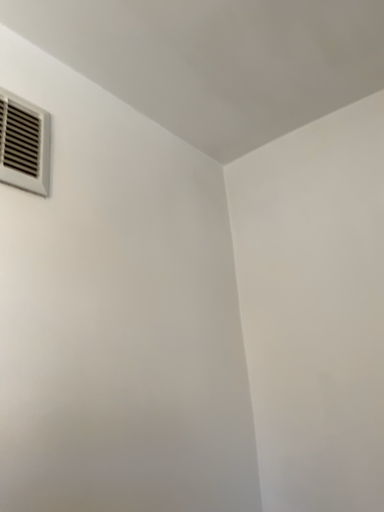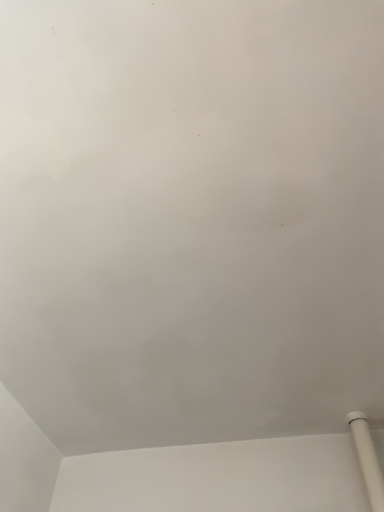
Question: Which way did the camera rotate in the video?

Choices:
 (A) rotated left
 (B) rotated right

Answer: (B)